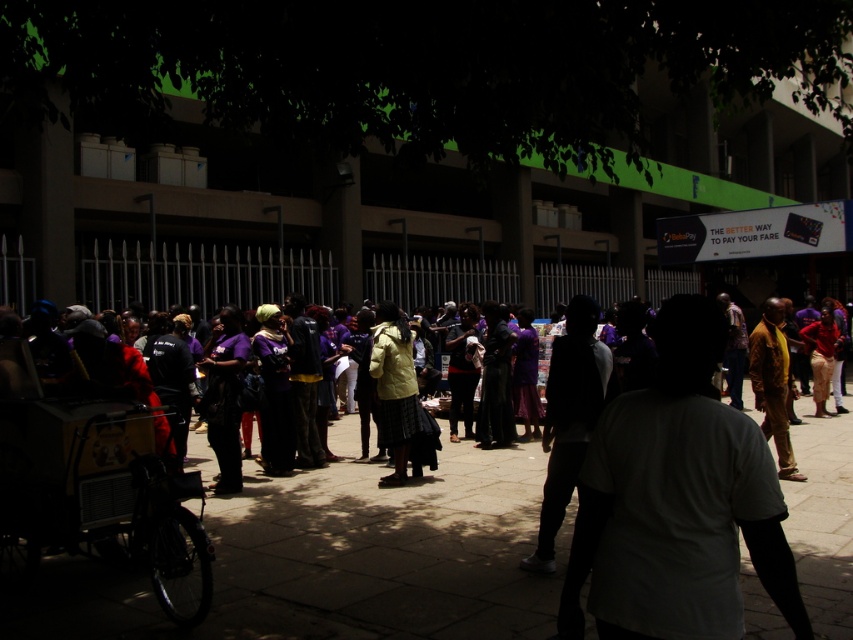
Question: Is purple fabric at center further to camera compared to white matte shirt at center?

Choices:
 (A) yes
 (B) no

Answer: (A)

Question: Can you confirm if white matte shirt at center is positioned to the left of brown textured shirt at right?

Choices:
 (A) no
 (B) yes

Answer: (B)

Question: Is white matte shirt at center below dark fabric pants at center?

Choices:
 (A) yes
 (B) no

Answer: (A)

Question: Which point is closer to the camera?

Choices:
 (A) brown textured shirt at right
 (B) dark fabric pants at center
 (C) yellow fabric skirt at center
 (D) purple fabric at center

Answer: (D)

Question: Which object is the closest to the white matte shirt at center?

Choices:
 (A) dark fabric pants at center
 (B) yellow fabric skirt at center
 (C) purple fabric at center
 (D) brown textured shirt at right

Answer: (A)

Question: Estimate the real-world distances between objects in this image. Which object is farther from the brown textured shirt at right?

Choices:
 (A) white matte shirt at center
 (B) purple fabric at center

Answer: (A)